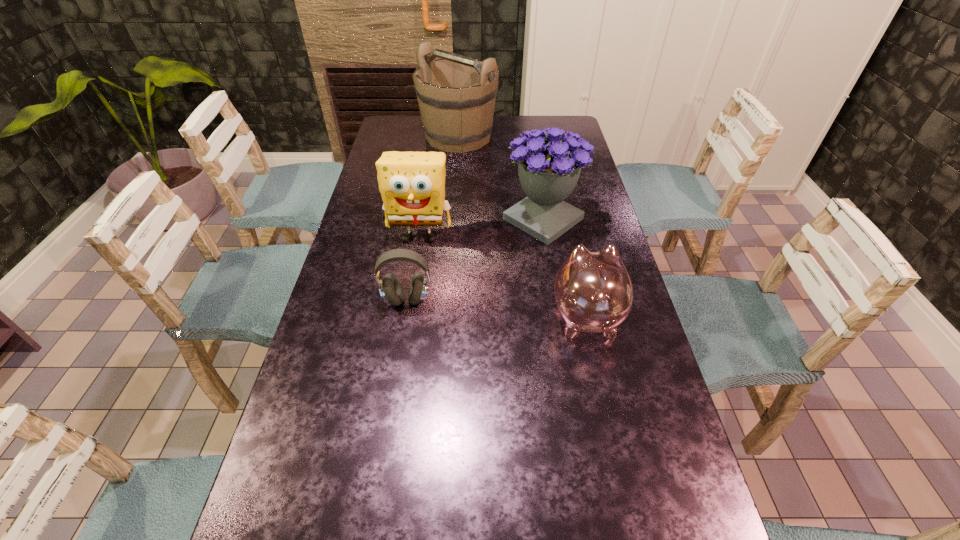
The image size is (960, 540). I want to click on the farthest object, so click(456, 94).

You are a GUI agent. You are given a task and a screenshot of the screen. Output one action in this format:
    pyautogui.click(x=<x>, y=<y>)
    Task: Click on the bouquet
    The image size is (960, 540).
    Given the screenshot: What is the action you would take?
    pyautogui.click(x=549, y=170)

Where is `sponge`? This screenshot has height=540, width=960. sponge is located at coordinates (412, 184).

At what (x,y) coordinates should I click in order to perform the action: click on piggy bank. Please return your answer as a coordinate pair (x, y). Looking at the image, I should click on (593, 290).

Identify the location of headset. This screenshot has width=960, height=540. (390, 288).

At what (x,y) coordinates should I click in order to perform the action: click on vacant space located 0.080m on the front of the farthest object. Please return your answer as a coordinate pair (x, y). Looking at the image, I should click on (456, 167).

Find the location of `vacant region located on the front of the bouquet`. vacant region located on the front of the bouquet is located at coordinates (553, 282).

The width and height of the screenshot is (960, 540). Identify the location of vacant space positioned on the face of the third shortest object. (415, 271).

You are a GUI agent. You are given a task and a screenshot of the screen. Output one action in this format:
    pyautogui.click(x=<x>, y=<y>)
    Task: Click on the vacant space located on the front facing side of the piggy bank
    
    Given the screenshot: What is the action you would take?
    pyautogui.click(x=565, y=220)

At what (x,y) coordinates should I click in order to perform the action: click on vacant space located 0.200m on the front facing side of the piggy bank. Please return your answer as a coordinate pair (x, y). Looking at the image, I should click on (569, 239).